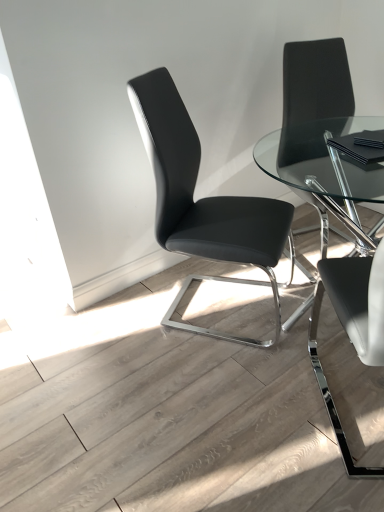
Question: From a real-world perspective, is black leather chair at center, which ranks as the 1th chair in left-to-right order, on top of black leather chair at upper right, marked as the 3th chair in a left-to-right arrangement?

Choices:
 (A) no
 (B) yes

Answer: (A)

Question: Considering the relative positions of black leather chair at center, the 3th chair from the right, and black leather chair at upper right, marked as the 3th chair in a left-to-right arrangement, in the image provided, is black leather chair at center, the 3th chair from the right, to the right of black leather chair at upper right, marked as the 3th chair in a left-to-right arrangement, from the viewer's perspective?

Choices:
 (A) yes
 (B) no

Answer: (B)

Question: From the image's perspective, would you say black leather chair at center, the 3th chair from the right, is shown under black leather chair at upper right, which appears as the first chair when viewed from the right?

Choices:
 (A) no
 (B) yes

Answer: (B)

Question: Is black leather chair at center, the 3th chair from the right, surrounding black leather chair at upper right, marked as the 3th chair in a left-to-right arrangement?

Choices:
 (A) no
 (B) yes

Answer: (A)

Question: Is black leather chair at center, which ranks as the 1th chair in left-to-right order, looking in the opposite direction of black leather chair at upper right, marked as the 3th chair in a left-to-right arrangement?

Choices:
 (A) no
 (B) yes

Answer: (A)

Question: In terms of size, does black leather chair at right, the second chair in the left-to-right sequence, appear bigger or smaller than black leather chair at upper right, which appears as the first chair when viewed from the right?

Choices:
 (A) small
 (B) big

Answer: (A)

Question: Is black leather chair at right, which is counted as the second chair, starting from the right, to the left or to the right of black leather chair at upper right, marked as the 3th chair in a left-to-right arrangement, in the image?

Choices:
 (A) left
 (B) right

Answer: (A)

Question: Is black leather chair at right, the second chair in the left-to-right sequence, situated inside black leather chair at upper right, which appears as the first chair when viewed from the right, or outside?

Choices:
 (A) inside
 (B) outside

Answer: (B)

Question: From the image's perspective, relative to black leather chair at upper right, marked as the 3th chair in a left-to-right arrangement, is black leather chair at right, which is counted as the second chair, starting from the right, above or below?

Choices:
 (A) below
 (B) above

Answer: (A)

Question: Relative to black leather chair at right, which is counted as the second chair, starting from the right, is black leather chair at upper right, which appears as the first chair when viewed from the right, in front or behind?

Choices:
 (A) behind
 (B) front

Answer: (A)

Question: Based on their sizes in the image, would you say black leather chair at upper right, which appears as the first chair when viewed from the right, is bigger or smaller than black leather chair at right, the second chair in the left-to-right sequence?

Choices:
 (A) small
 (B) big

Answer: (B)

Question: Considering the relative positions of black leather chair at upper right, which appears as the first chair when viewed from the right, and black leather chair at right, which is counted as the second chair, starting from the right, in the image provided, is black leather chair at upper right, which appears as the first chair when viewed from the right, to the left or to the right of black leather chair at right, which is counted as the second chair, starting from the right,?

Choices:
 (A) left
 (B) right

Answer: (B)

Question: Is point (319, 55) closer or farther from the camera than point (324, 282)?

Choices:
 (A) closer
 (B) farther

Answer: (B)

Question: In terms of height, does black leather chair at right, which is counted as the second chair, starting from the right, look taller or shorter compared to black leather chair at center, the 3th chair from the right?

Choices:
 (A) short
 (B) tall

Answer: (A)

Question: Visually, is black leather chair at right, which is counted as the second chair, starting from the right, positioned to the left or to the right of black leather chair at center, which ranks as the 1th chair in left-to-right order?

Choices:
 (A) right
 (B) left

Answer: (A)